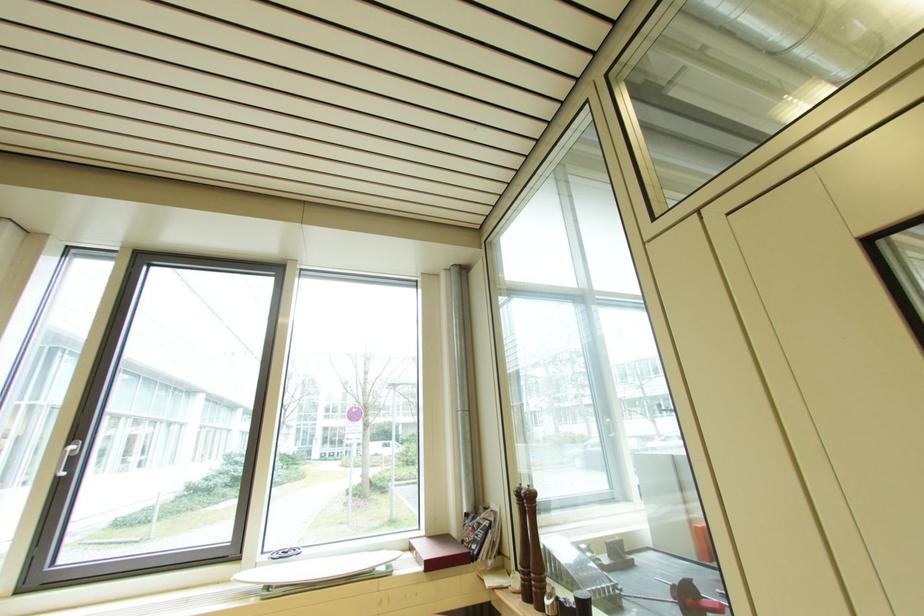
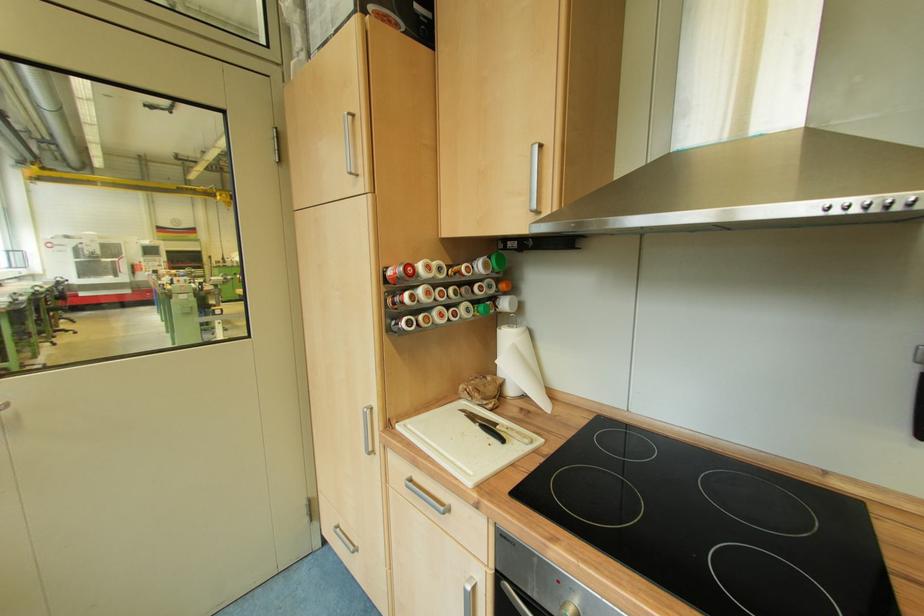
Question: The camera is either moving clockwise (left) or counter-clockwise (right) around the object. The first image is from the beginning of the video and the second image is from the end. Is the camera moving left or right when shooting the video?

Choices:
 (A) Left
 (B) Right

Answer: (A)